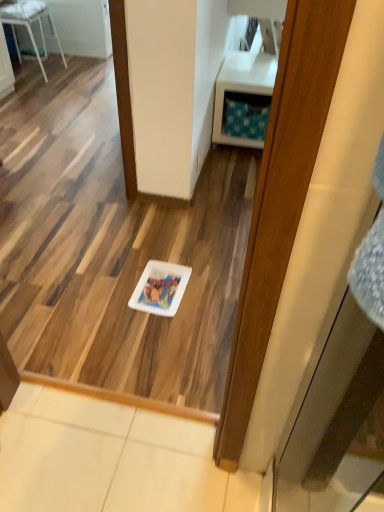
Find the location of `free point in front of white glossy plate at center`. free point in front of white glossy plate at center is located at coordinates (158, 333).